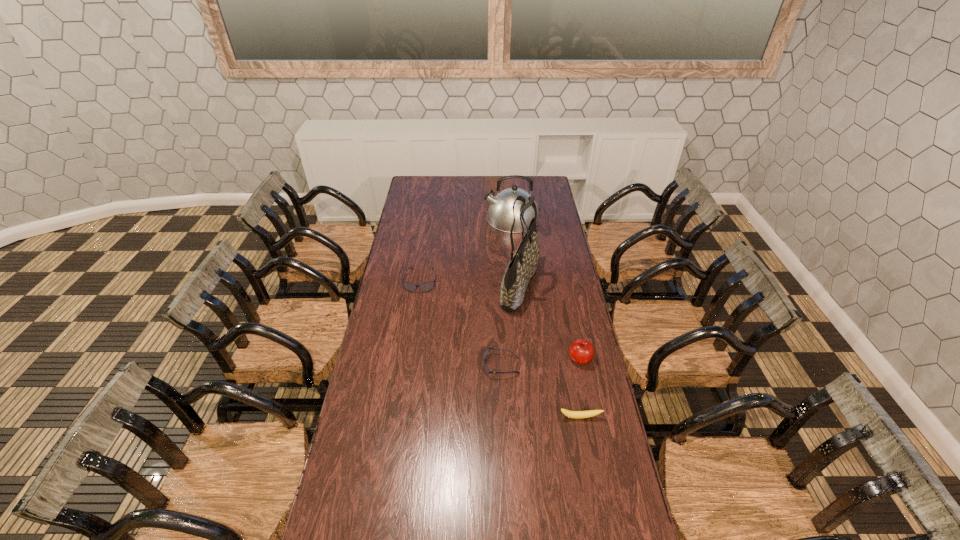
This screenshot has width=960, height=540. Find the location of `kettle that is at the right edge`. kettle that is at the right edge is located at coordinates (500, 215).

This screenshot has width=960, height=540. I want to click on apple that is at the right edge, so [581, 351].

Identify the location of banana at the right edge. (571, 414).

This screenshot has width=960, height=540. Identify the location of blank area at the far edge. (452, 183).

This screenshot has height=540, width=960. What are the coordinates of `vacant space at the left edge of the desktop` in the screenshot? It's located at (400, 249).

You are a GUI agent. You are given a task and a screenshot of the screen. Output one action in this format:
    pyautogui.click(x=<x>, y=<y>)
    Task: Click on the free space at the right edge
    This screenshot has width=960, height=540.
    Given the screenshot: What is the action you would take?
    pyautogui.click(x=547, y=265)

The width and height of the screenshot is (960, 540). I want to click on free point at the near left corner, so click(x=381, y=505).

At what (x,y) coordinates should I click in order to perform the action: click on free location at the far right corner of the desktop. Please return your answer as a coordinate pair (x, y). The height and width of the screenshot is (540, 960). Looking at the image, I should click on [x=527, y=184].

Where is `free space between the nearest object and the apple`? The image size is (960, 540). free space between the nearest object and the apple is located at coordinates (580, 388).

Find the location of `free space between the banana and the farthest object`. free space between the banana and the farthest object is located at coordinates (546, 318).